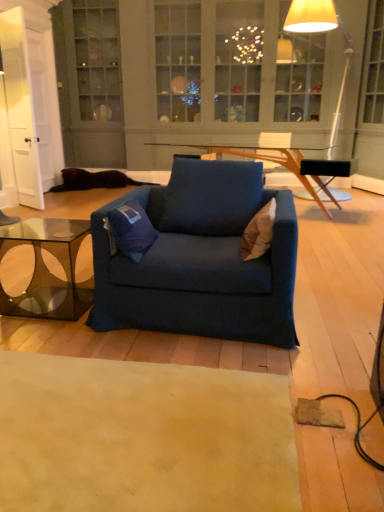
Question: From the image's perspective, is transparent glass coffee table at lower left under beige fabric pillow at center, marked as the 1th pillow in a right-to-left arrangement?

Choices:
 (A) yes
 (B) no

Answer: (A)

Question: Is transparent glass coffee table at lower left at the right side of beige fabric pillow at center, the 2th pillow viewed from the left?

Choices:
 (A) no
 (B) yes

Answer: (A)

Question: Is transparent glass coffee table at lower left positioned with its back to beige fabric pillow at center, the 2th pillow viewed from the left?

Choices:
 (A) no
 (B) yes

Answer: (A)

Question: Can you confirm if transparent glass coffee table at lower left is thinner than beige fabric pillow at center, marked as the 1th pillow in a right-to-left arrangement?

Choices:
 (A) no
 (B) yes

Answer: (A)

Question: Can you confirm if transparent glass coffee table at lower left is smaller than beige fabric pillow at center, the 2th pillow viewed from the left?

Choices:
 (A) yes
 (B) no

Answer: (B)

Question: Does point (263, 180) appear closer or farther from the camera than point (271, 212)?

Choices:
 (A) farther
 (B) closer

Answer: (A)

Question: Choose the correct answer: Is blue fabric armchair at center inside beige fabric pillow at center, the 2th pillow viewed from the left, or outside it?

Choices:
 (A) inside
 (B) outside

Answer: (B)

Question: In terms of width, does blue fabric armchair at center look wider or thinner when compared to beige fabric pillow at center, marked as the 1th pillow in a right-to-left arrangement?

Choices:
 (A) wide
 (B) thin

Answer: (A)

Question: From their relative heights in the image, would you say blue fabric armchair at center is taller or shorter than beige fabric pillow at center, marked as the 1th pillow in a right-to-left arrangement?

Choices:
 (A) tall
 (B) short

Answer: (A)

Question: From a real-world perspective, is transparent glass coffee table at lower left positioned above or below blue fabric chair at center?

Choices:
 (A) above
 (B) below

Answer: (B)

Question: From the image's perspective, relative to blue fabric chair at center, is transparent glass coffee table at lower left above or below?

Choices:
 (A) above
 (B) below

Answer: (B)

Question: In the image, is transparent glass coffee table at lower left on the left side or the right side of blue fabric chair at center?

Choices:
 (A) right
 (B) left

Answer: (B)

Question: Considering the positions of point (49, 294) and point (216, 157), is point (49, 294) closer or farther from the camera than point (216, 157)?

Choices:
 (A) closer
 (B) farther

Answer: (A)

Question: Do you think blue fabric armchair at center is within transparent glass coffee table at lower left, or outside of it?

Choices:
 (A) outside
 (B) inside

Answer: (A)

Question: Considering the positions of blue fabric armchair at center and transparent glass coffee table at lower left in the image, is blue fabric armchair at center taller or shorter than transparent glass coffee table at lower left?

Choices:
 (A) short
 (B) tall

Answer: (B)